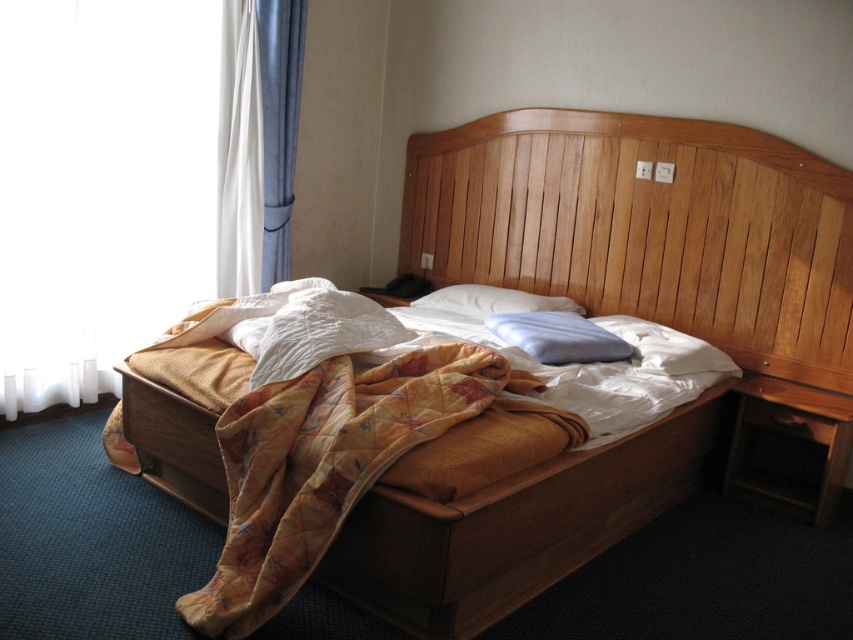
You are planning to place a new decorative pillow on the quilted orange bed at center. Considering the size of the quilted orange blanket at center, will the pillow fit comfortably without overlapping the edges of the bed?

The quilted orange bed at center is wider than the quilted orange blanket at center, so placing a decorative pillow on the bed should allow enough space without overlapping the edges of the bed.

You are trying to decide whether to place a new rectangular decorative item on the quilted orange bed at center or the white soft pillow at center. Which surface has more space to accommodate the item?

The quilted orange bed at center has a larger width than the white soft pillow at center, so it can accommodate the decorative item more easily.